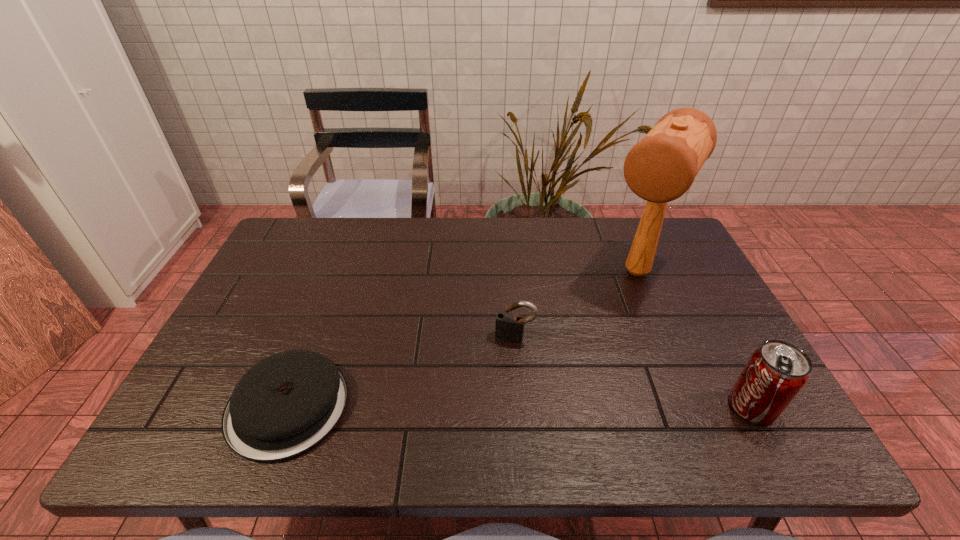
Locate an element on the screen. The width and height of the screenshot is (960, 540). free spot on the desktop that is between the pancake and the third shortest object and is positioned on the strike surface of the tallest object is located at coordinates (551, 407).

Locate an element on the screen. The width and height of the screenshot is (960, 540). vacant spot on the desktop that is between the shortest object and the third shortest object and is positioned with the keyhole on the front of the padlock is located at coordinates (496, 407).